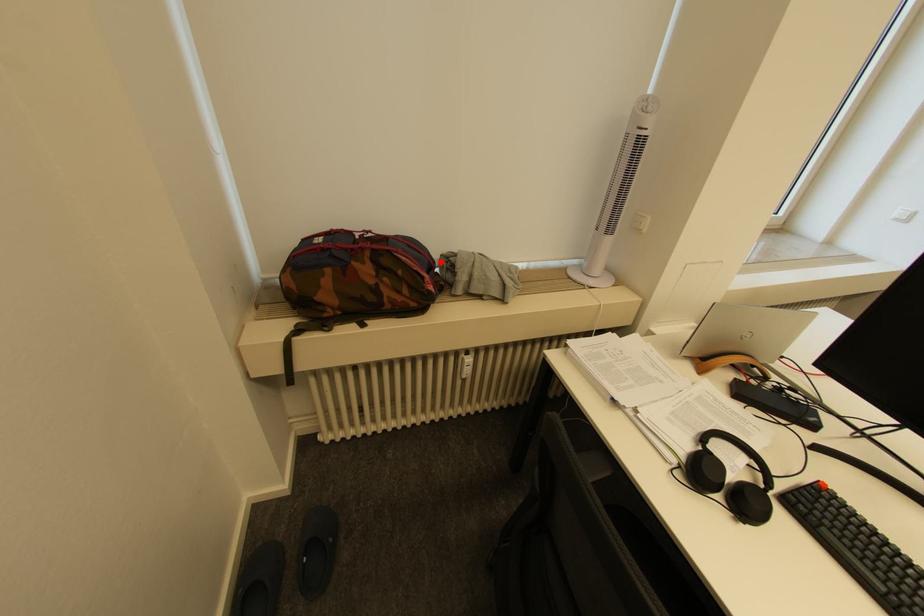
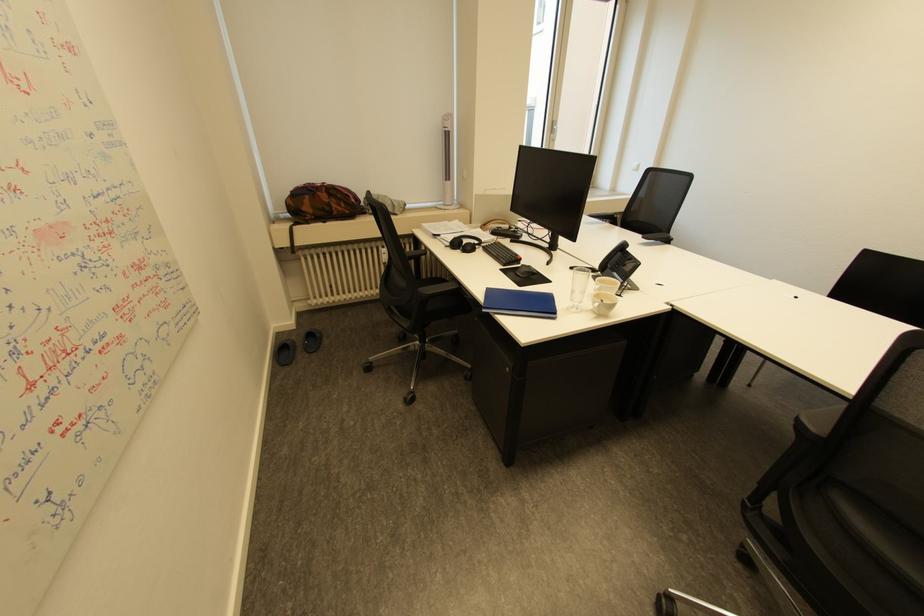
Find the pixel in the second image that matches the highlighted location in the first image.

(367, 200)